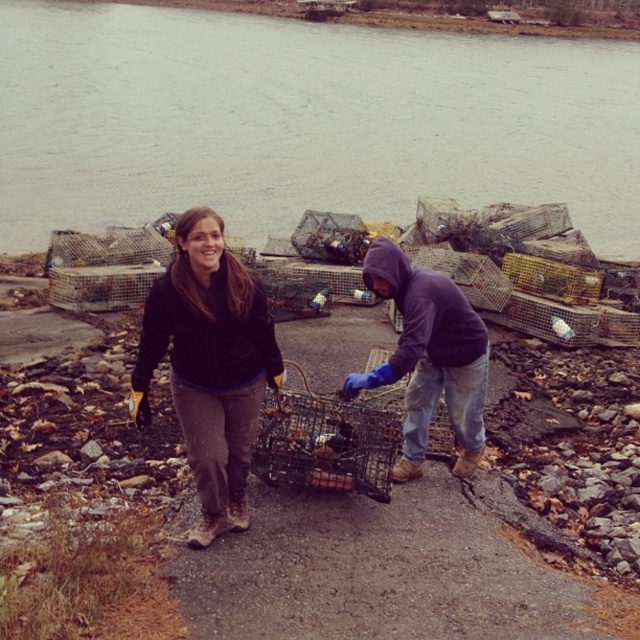
Looking at this image, you are a photographer trying to capture a photo of the gray water at upper center and the matte blue gloves at center. From the perspective of the camera, which object is located to the left?

The matte blue gloves at center are to the left of the gray water at upper center because the gray water at upper center is positioned on the right side of matte blue gloves at center.

Based on the scene description, where is the gray water at upper center located in terms of coordinates?

The gray water at upper center is located at coordinates point (x=301, y=122).

You are a photographer trying to capture both the black fleece jacket at center and the matte blue gloves at center in a single frame. Since you want to ensure both are fully visible, which object should you focus on to avoid cropping either?

You should focus on the matte blue gloves at center because it is wider than the black fleece jacket at center, so centering on the wider object ensures both fit within the frame.